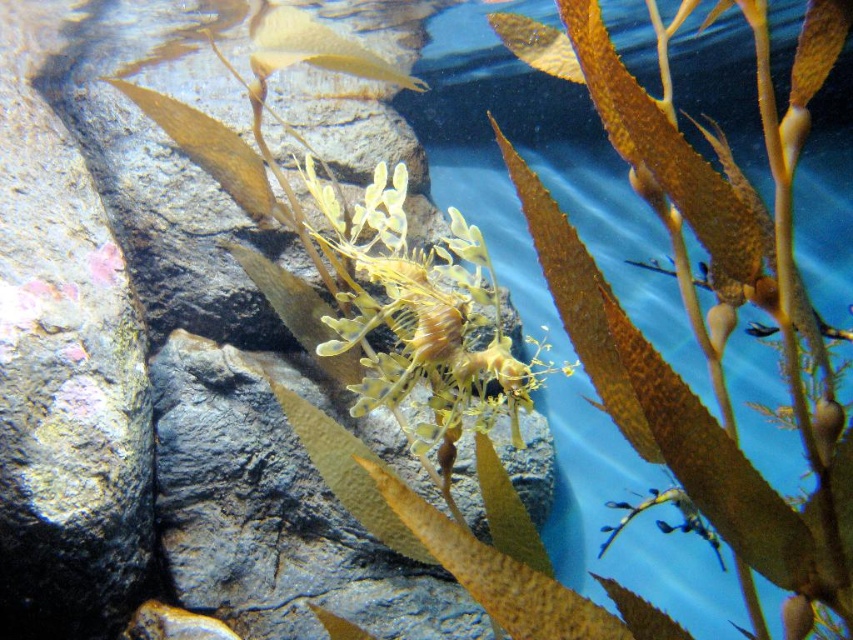
Question: Which object is the farthest from the translucent yellow leaf at upper center?

Choices:
 (A) translucent yellowish-green seahorse at center
 (B) translucent yellow seahorse at center

Answer: (A)

Question: Among these objects, which one is nearest to the camera?

Choices:
 (A) translucent yellow leaf at upper center
 (B) translucent yellow seahorse at center
 (C) translucent yellowish-green seahorse at center

Answer: (B)

Question: Is translucent yellow seahorse at center closer to camera compared to translucent yellow leaf at upper center?

Choices:
 (A) yes
 (B) no

Answer: (A)

Question: Is translucent yellow seahorse at center thinner than translucent yellow leaf at upper center?

Choices:
 (A) no
 (B) yes

Answer: (A)

Question: Can you confirm if translucent yellow seahorse at center is positioned to the right of translucent yellowish-green seahorse at center?

Choices:
 (A) yes
 (B) no

Answer: (B)

Question: Which of the following is the farthest from the observer?

Choices:
 (A) translucent yellow leaf at upper center
 (B) translucent yellow seahorse at center
 (C) translucent yellowish-green seahorse at center

Answer: (C)